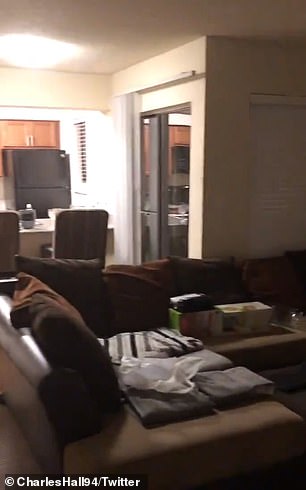
Find the location of a particular element. This screenshot has height=490, width=306. cabinet above refridgerator is located at coordinates [30, 129].